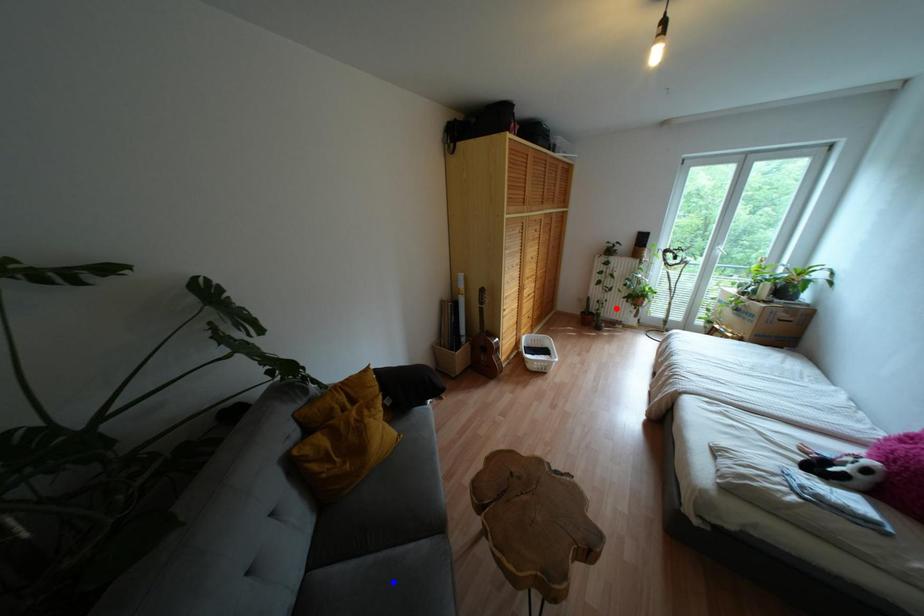
Question: Two points are marked on the image. Which point is closer to the camera?

Choices:
 (A) Blue point is closer.
 (B) Red point is closer.

Answer: (A)